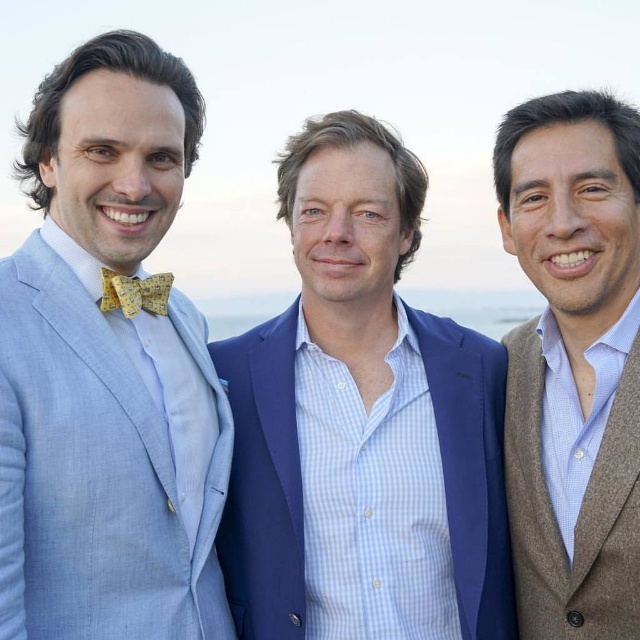
You are a photographer positioned at the center of the image. You need to capture a photo that includes both the light blue linen suit at left and the navy suit at center. Which direction should you adjust your camera to ensure both suits are in frame?

The light blue linen suit at left is located at point (108,369) and the navy suit at center is at point (320,320). To include both, adjust the camera slightly to the left to ensure both suits are within the frame.

You are a photographer trying to capture a photo of the blue textured suit at center. Based on its position, where should you aim your camera?

The blue textured suit at center is located at point (362, 422), so aim your camera at those coordinates to capture it properly.

You are a tailor observing the three men. You need to determine which garment, the blue textured suit at center or the brown wool sweater at right, requires more fabric for alterations. Based on their widths, which one should you prioritize?

The blue textured suit at center is wider than the brown wool sweater at right, so it requires more fabric for alterations and should be prioritized.